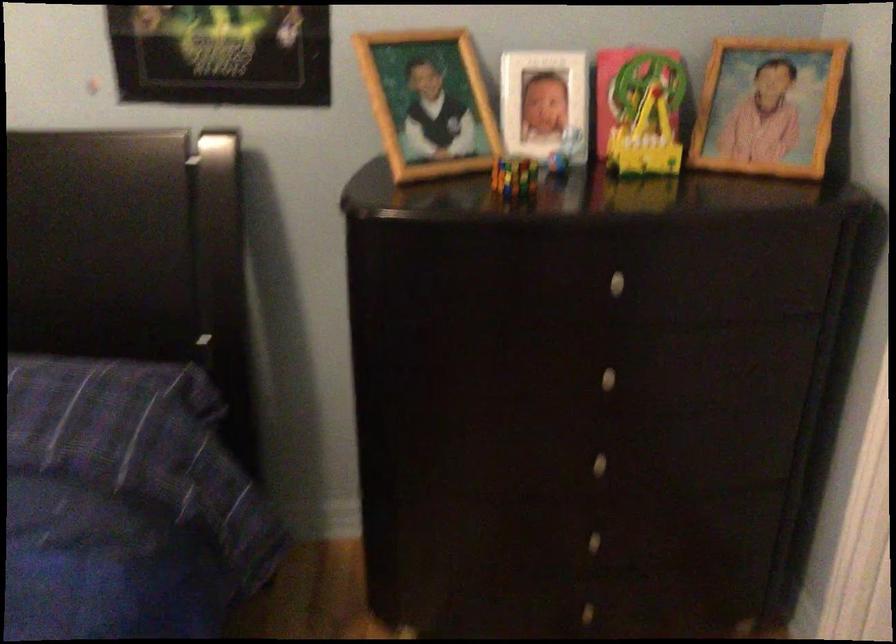
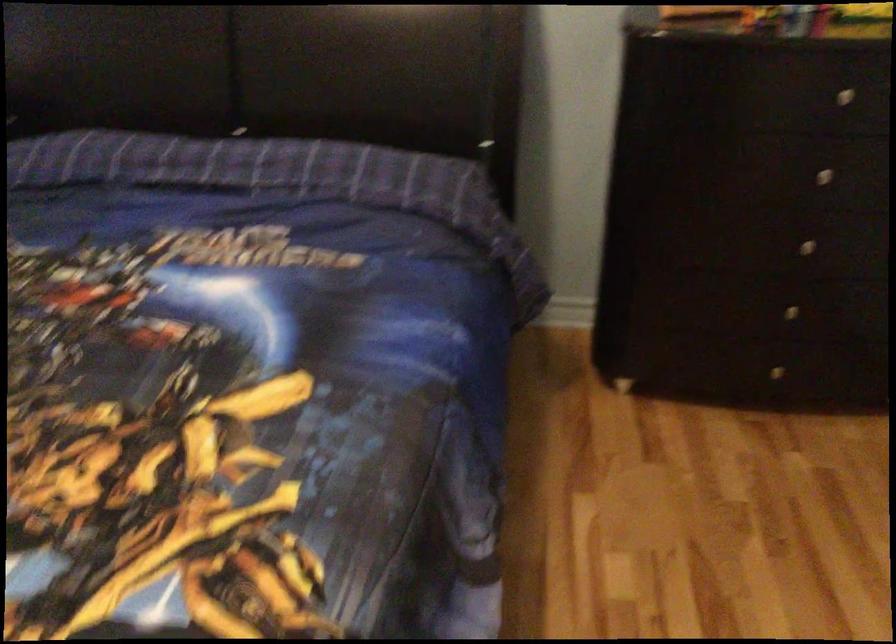
Find the pixel in the second image that matches point 624,368 in the first image.

(833, 169)